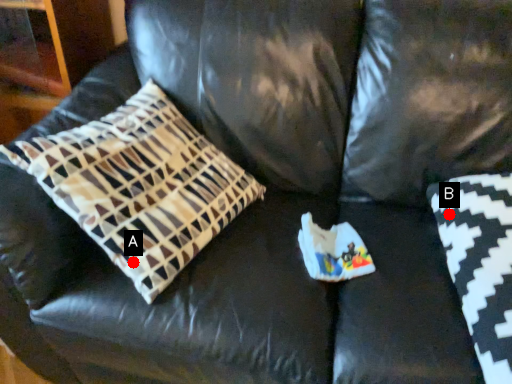
Question: Two points are circled on the image, labeled by A and B beside each circle. Among these points, which one is farthest from the camera?

Choices:
 (A) A is further
 (B) B is further

Answer: (B)